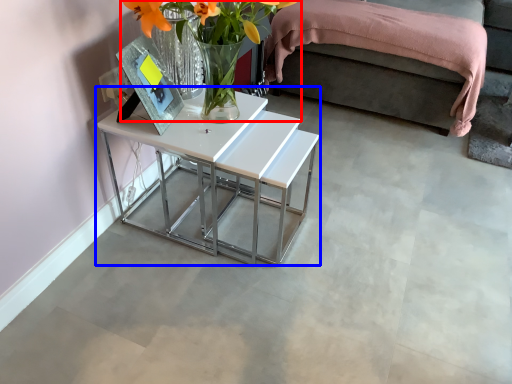
Question: Which point is closer to the camera, floral arrangement (highlighted by a red box) or table (highlighted by a blue box)?

Choices:
 (A) floral arrangement
 (B) table

Answer: (A)